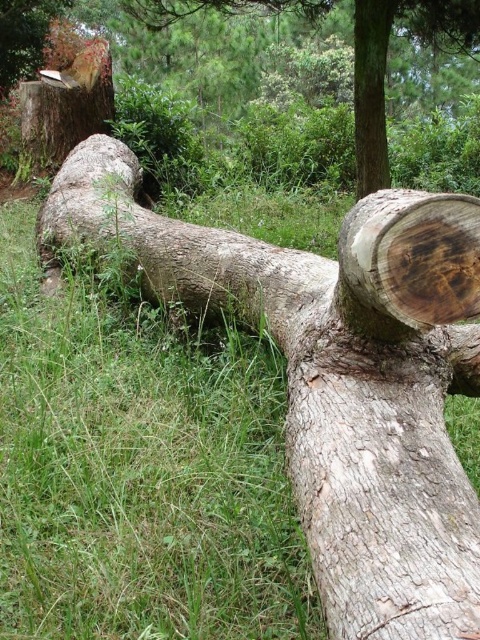
Can you confirm if green grass at center is positioned above smooth brown log at center?

No.

Between point (257, 515) and point (365, 35), which one is positioned in front?

Point (257, 515) is more forward.

The height and width of the screenshot is (640, 480). What are the coordinates of `green grass at center` in the screenshot? It's located at (139, 470).

This screenshot has width=480, height=640. Find the location of `green grass at center`. green grass at center is located at coordinates (139, 470).